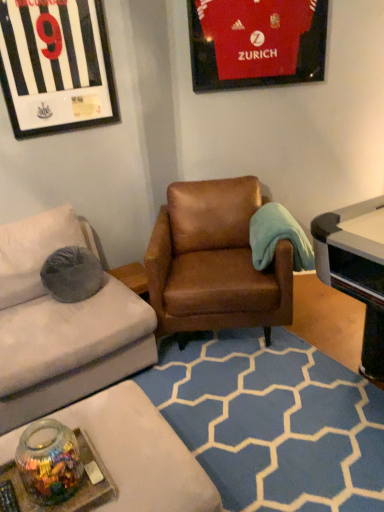
Identify the location of free space to the right of black plastic remote control at lower left. This screenshot has width=384, height=512. pos(69,497).